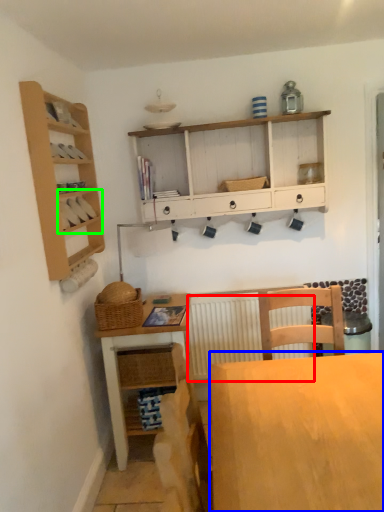
Question: Based on their relative distances, which object is farther from radiator (highlighted by a red box)? Choose from desk (highlighted by a blue box) and cabinet (highlighted by a green box).

Choices:
 (A) desk
 (B) cabinet

Answer: (A)